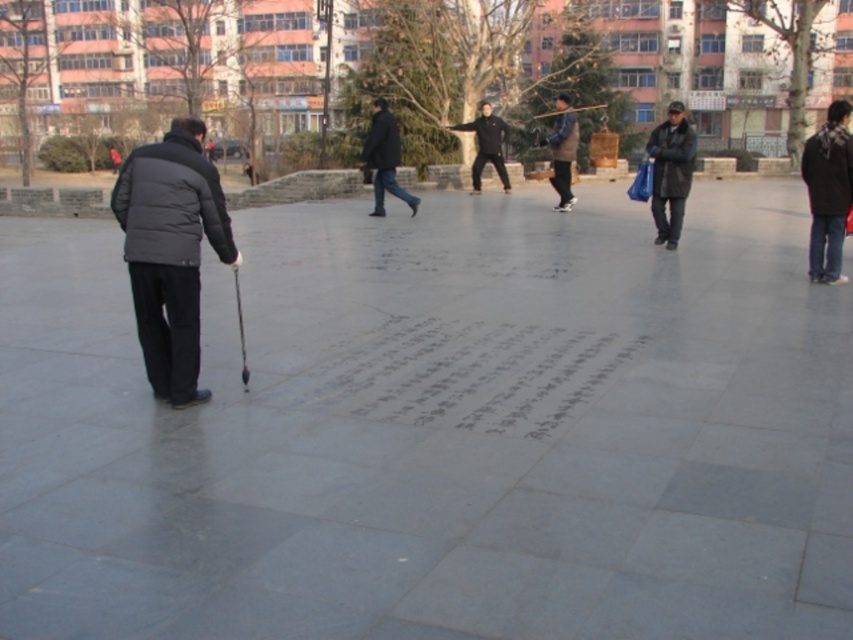
You are a photographer trying to capture both the dark gray matte jacket at left and the dark gray jacket at center in a single frame. Which jacket should you focus on to ensure both are in the frame without zooming in too much?

You should focus on the dark gray jacket at center because it is larger in size compared to the dark gray matte jacket at left, allowing both to fit within the frame without excessive zooming.

You are a photographer positioned in the public square. You want to take a photo of both the dark gray matte jacket at left and the dark brown leather jacket at right without any obstructions. Based on their positions, which jacket should you focus on first to ensure both are visible in the frame?

The dark gray matte jacket at left is in front of the dark brown leather jacket at right, so you should focus on the dark gray matte jacket at left first to ensure it doesn not block the view of the dark brown leather jacket at right.